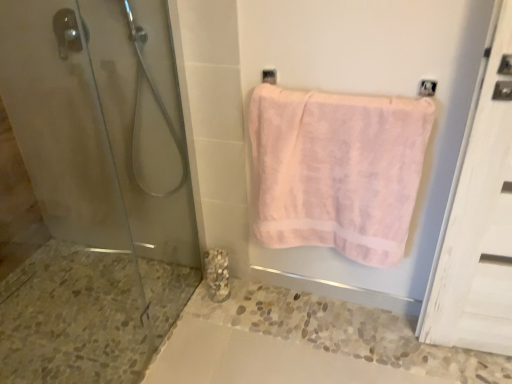
Question: Considering the relative sizes of pink fluffy towel at upper right and clear glass shower at left in the image provided, is pink fluffy towel at upper right shorter than clear glass shower at left?

Choices:
 (A) yes
 (B) no

Answer: (A)

Question: Is pink fluffy towel at upper right in front of clear glass shower at left?

Choices:
 (A) no
 (B) yes

Answer: (B)

Question: Does pink fluffy towel at upper right have a greater width compared to clear glass shower at left?

Choices:
 (A) yes
 (B) no

Answer: (A)

Question: Considering the relative sizes of pink fluffy towel at upper right and clear glass shower at left in the image provided, is pink fluffy towel at upper right thinner than clear glass shower at left?

Choices:
 (A) yes
 (B) no

Answer: (B)

Question: From the image's perspective, is pink fluffy towel at upper right beneath clear glass shower at left?

Choices:
 (A) yes
 (B) no

Answer: (A)

Question: Is point (391, 182) positioned closer to the camera than point (137, 77)?

Choices:
 (A) farther
 (B) closer

Answer: (B)

Question: From the image's perspective, relative to transparent glass shower door at left, is pink fluffy towel at upper right above or below?

Choices:
 (A) above
 (B) below

Answer: (A)

Question: Considering the positions of pink fluffy towel at upper right and transparent glass shower door at left in the image, is pink fluffy towel at upper right wider or thinner than transparent glass shower door at left?

Choices:
 (A) thin
 (B) wide

Answer: (A)

Question: Considering the positions of pink fluffy towel at upper right and transparent glass shower door at left in the image, is pink fluffy towel at upper right taller or shorter than transparent glass shower door at left?

Choices:
 (A) short
 (B) tall

Answer: (A)

Question: Which is correct: transparent glass shower door at left is inside marble textured at lower left, or outside of it?

Choices:
 (A) inside
 (B) outside

Answer: (B)

Question: In terms of width, does transparent glass shower door at left look wider or thinner when compared to marble textured at lower left?

Choices:
 (A) thin
 (B) wide

Answer: (B)

Question: From the image's perspective, is transparent glass shower door at left positioned above or below marble textured at lower left?

Choices:
 (A) below
 (B) above

Answer: (B)

Question: Visually, is transparent glass shower door at left positioned to the left or to the right of marble textured at lower left?

Choices:
 (A) right
 (B) left

Answer: (B)

Question: From a real-world perspective, is clear glass shower at left physically located above or below matte silver towel bar at upper center?

Choices:
 (A) above
 (B) below

Answer: (B)

Question: Considering the positions of clear glass shower at left and matte silver towel bar at upper center in the image, is clear glass shower at left bigger or smaller than matte silver towel bar at upper center?

Choices:
 (A) small
 (B) big

Answer: (B)